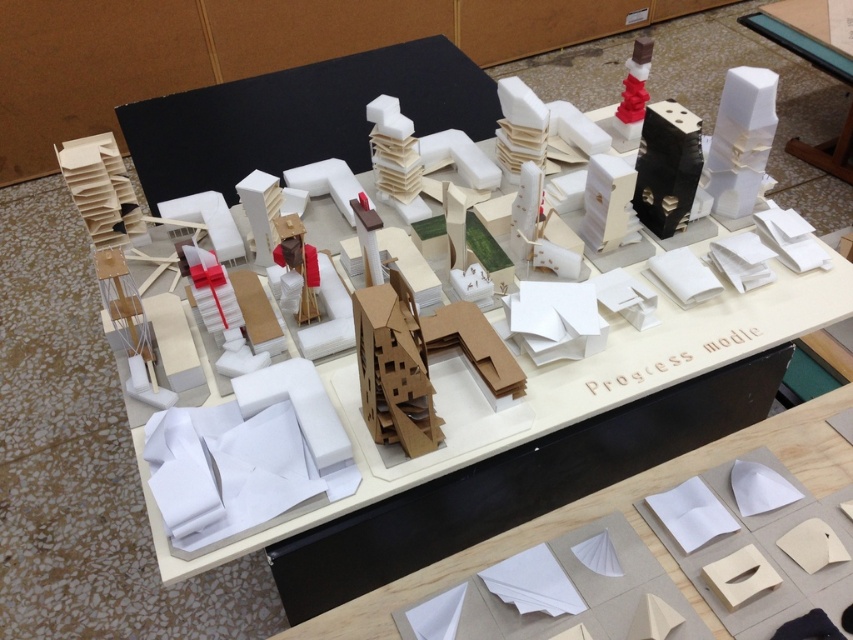
Is white paper at center closer to camera compared to white cardboard table at center?

Yes, it is in front of white cardboard table at center.

Can you confirm if white paper at center is positioned to the left of white cardboard table at center?

Yes, white paper at center is to the left of white cardboard table at center.

Does point (792, 445) come behind point (838, 134)?

No, (792, 445) is closer to viewer.

Locate an element on the screen. The width and height of the screenshot is (853, 640). white paper at center is located at coordinates (610, 512).